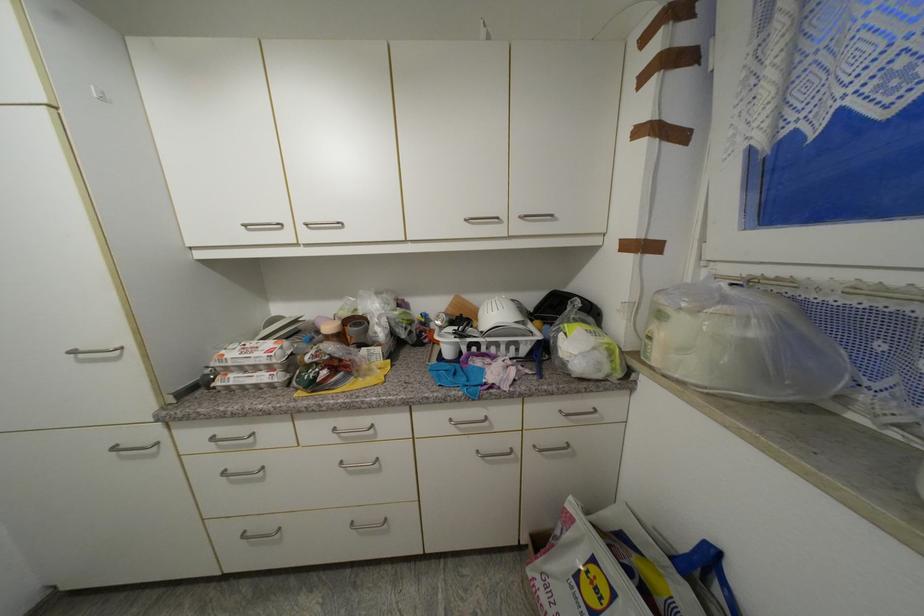
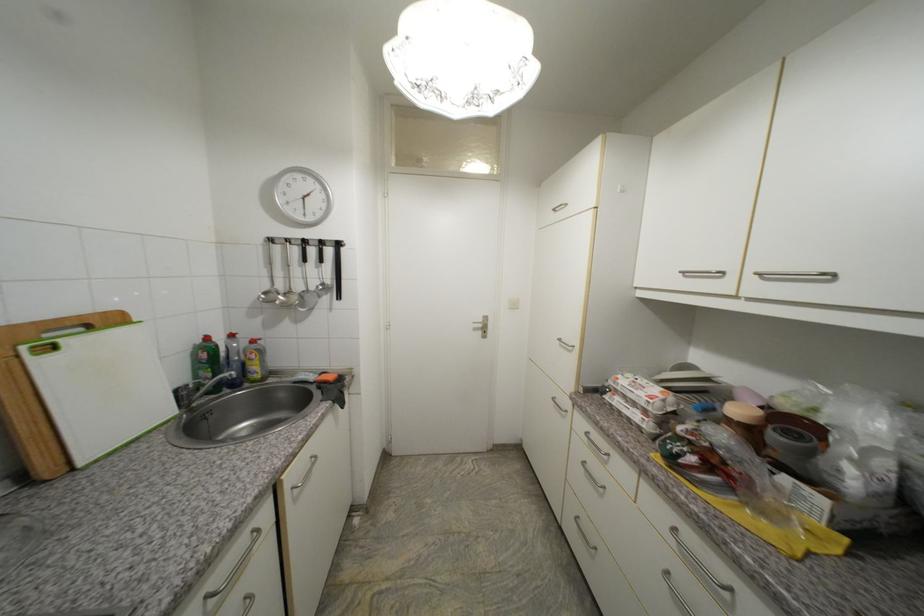
Locate, in the second image, the point that corresponds to [79,354] in the first image.

(565, 341)